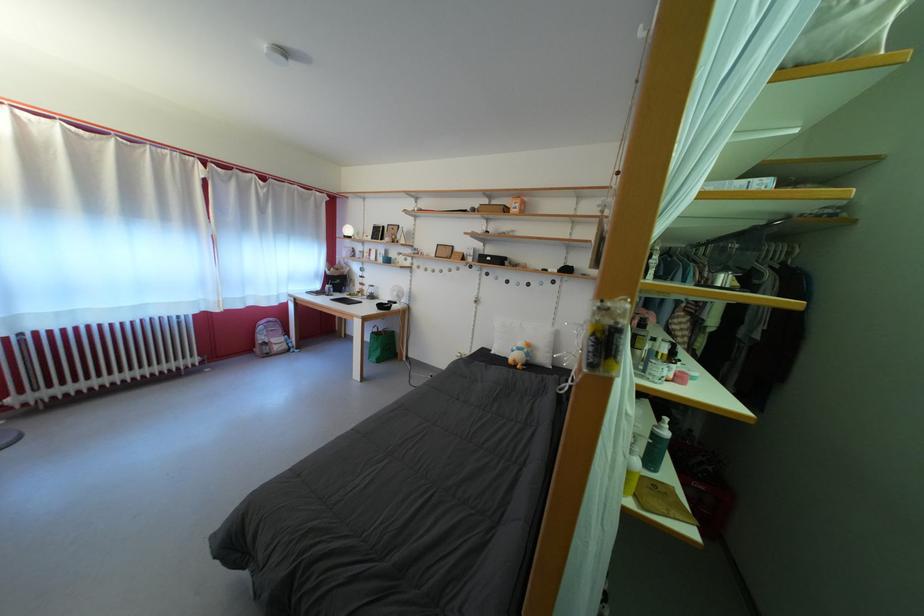
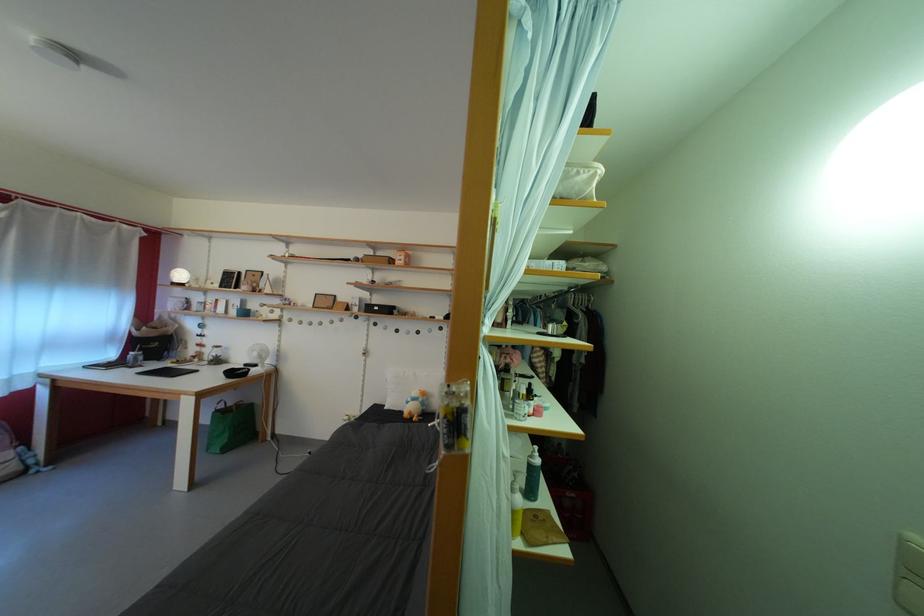
The images are taken continuously from a first-person perspective. In which direction are you moving?

The cameraman moved toward right, backward.